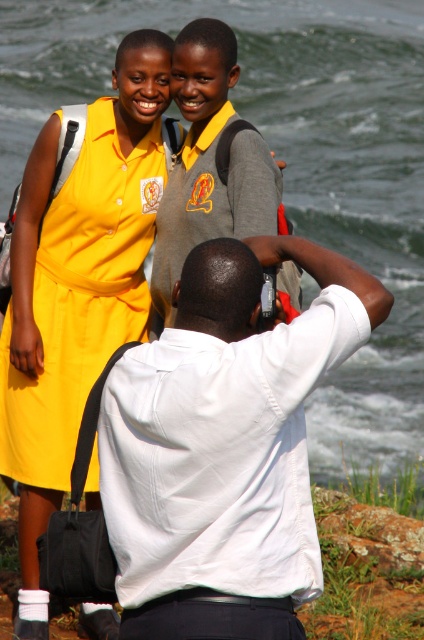
Question: Which object is farther from the camera taking this photo?

Choices:
 (A) white cotton shirt at center
 (B) gray fabric uniform at center

Answer: (B)

Question: Does white cotton shirt at center have a larger size compared to gray fabric uniform at center?

Choices:
 (A) no
 (B) yes

Answer: (A)

Question: Which point is farther from the camera taking this photo?

Choices:
 (A) (190, 358)
 (B) (257, 208)
 (C) (148, 182)

Answer: (C)

Question: Does yellow fabric dress at upper left have a greater width compared to white cotton shirt at center?

Choices:
 (A) no
 (B) yes

Answer: (B)

Question: Among these points, which one is nearest to the camera?

Choices:
 (A) (142, 220)
 (B) (287, 278)
 (C) (320, 560)

Answer: (C)

Question: Is yellow fabric dress at upper left thinner than white cotton shirt at center?

Choices:
 (A) no
 (B) yes

Answer: (A)